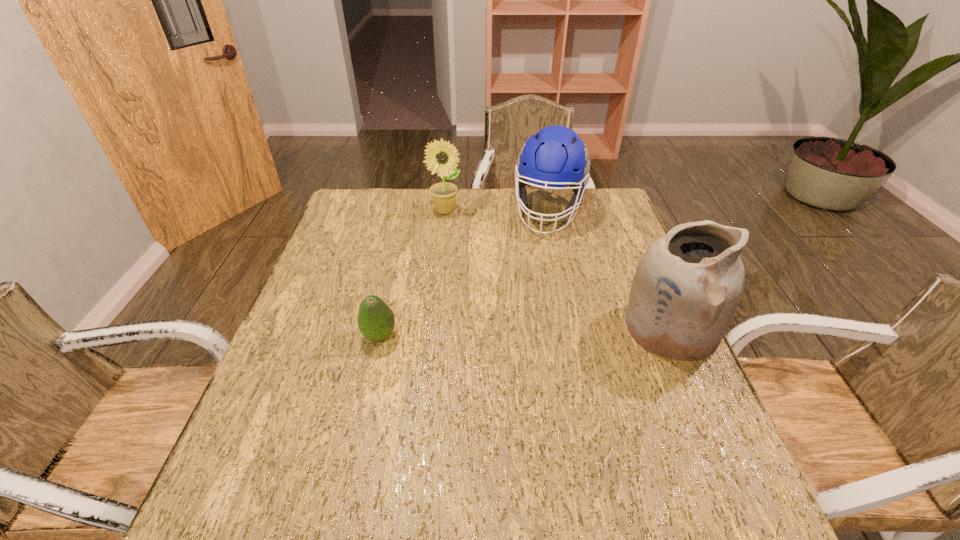
This screenshot has height=540, width=960. Find the location of `avocado`. avocado is located at coordinates (376, 321).

Identify the location of the leftmost object. This screenshot has height=540, width=960. (376, 321).

Identify the location of pottery. (686, 289).

This screenshot has width=960, height=540. Identify the location of the third object from left to right. (555, 157).

This screenshot has height=540, width=960. What are the coordinates of `sunflower` in the screenshot? It's located at (443, 195).

Locate an element on the screen. The width and height of the screenshot is (960, 540). vacant area located 0.310m on the right of the shortest object is located at coordinates (528, 336).

Image resolution: width=960 pixels, height=540 pixels. Find the location of `vacant space located on the back of the pottery`. vacant space located on the back of the pottery is located at coordinates (639, 256).

This screenshot has width=960, height=540. Identify the location of blank space located on the face guard of the football helmet. (534, 278).

At what (x,y) coordinates should I click in order to perform the action: click on vacant region located 0.260m on the face guard of the football helmet. Please return your answer as a coordinate pair (x, y). The image size is (960, 540). Looking at the image, I should click on (530, 295).

This screenshot has height=540, width=960. What are the coordinates of `free space located on the face guard of the football helmet` in the screenshot? It's located at (542, 248).